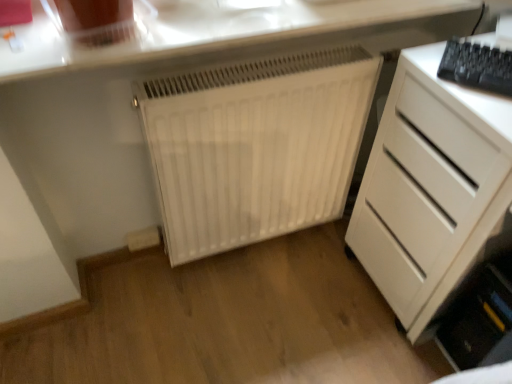
Measure the distance between point (x=445, y=75) and camera.

34.02 inches.

Locate an element on the screen. white glossy countertop at upper center is located at coordinates (206, 31).

I want to click on black plastic keyboard at upper right, so click(x=477, y=66).

Can you confirm if white matte chest of drawers at right is wider than black plastic keyboard at upper right?

Indeed, white matte chest of drawers at right has a greater width compared to black plastic keyboard at upper right.

Is white matte chest of drawers at right looking in the opposite direction of black plastic keyboard at upper right?

No, black plastic keyboard at upper right is not at the back of white matte chest of drawers at right.

The height and width of the screenshot is (384, 512). Find the location of `keyboard above the white matte chest of drawers at right (from the image's perspective)`. keyboard above the white matte chest of drawers at right (from the image's perspective) is located at coordinates (477, 66).

From the image's perspective, is white matte chest of drawers at right above black plastic keyboard at upper right?

No, from the image's perspective, white matte chest of drawers at right is not on top of black plastic keyboard at upper right.

Would you say black plastic keyboard at upper right contains white matte chest of drawers at right?

No, black plastic keyboard at upper right does not contain white matte chest of drawers at right.

Does point (452, 39) appear closer or farther from the camera than point (386, 263)?

Point (452, 39).

Which of these two, black plastic keyboard at upper right or white matte chest of drawers at right, is wider?

With larger width is white matte chest of drawers at right.

Looking at this image, considering the relative sizes of black plastic keyboard at upper right and white matte chest of drawers at right in the image provided, is black plastic keyboard at upper right smaller than white matte chest of drawers at right?

Indeed, black plastic keyboard at upper right has a smaller size compared to white matte chest of drawers at right.

How much distance is there between black plastic keyboard at upper right and white glossy countertop at upper center?

black plastic keyboard at upper right is 15.26 inches away from white glossy countertop at upper center.

Is point (509, 87) closer or farther from the camera than point (266, 35)?

Point (509, 87) is positioned closer to the camera compared to point (266, 35).

Where is `keyboard below the white glossy countertop at upper center (from a real-world perspective)`? keyboard below the white glossy countertop at upper center (from a real-world perspective) is located at coordinates (477, 66).

Who is smaller, black plastic keyboard at upper right or white glossy countertop at upper center?

black plastic keyboard at upper right is smaller.

Considering the relative sizes of black plastic keyboard at upper right and white matte radiator at center in the image provided, is black plastic keyboard at upper right shorter than white matte radiator at center?

Indeed, black plastic keyboard at upper right has a lesser height compared to white matte radiator at center.

Is black plastic keyboard at upper right looking in the opposite direction of white matte radiator at center?

No, black plastic keyboard at upper right is not facing away from white matte radiator at center.

From a real-world perspective, between black plastic keyboard at upper right and white matte radiator at center, who is vertically higher?

In real-world perspective, black plastic keyboard at upper right is above.

Is white glossy countertop at upper center not near white matte radiator at center?

No.

Is point (155, 46) closer or farther from the camera than point (252, 86)?

Point (155, 46) is closer to the camera than point (252, 86).

How different are the orientations of white glossy countertop at upper center and white matte radiator at center in degrees?

The angular difference between white glossy countertop at upper center and white matte radiator at center is 0.555 degrees.

From the image's perspective, is white glossy countertop at upper center located above or below white matte radiator at center?

From the image's perspective, white glossy countertop at upper center appears above white matte radiator at center.

Is white matte chest of drawers at right beside white matte radiator at center?

white matte chest of drawers at right is not next to white matte radiator at center, and they're not touching.

At what (x,y) coordinates should I click in order to perform the action: click on radiator lying on the left of white matte chest of drawers at right. Please return your answer as a coordinate pair (x, y). The image size is (512, 384). Looking at the image, I should click on (255, 145).

Does point (430, 139) come behind point (292, 124)?

No, it is not.

From the image's perspective, which object appears higher, white matte chest of drawers at right or white matte radiator at center?

From the image's view, white matte radiator at center is above.

The width and height of the screenshot is (512, 384). In order to click on the chest of drawers positioned vertically above the white matte radiator at center (from a real-world perspective) in this screenshot , I will do `click(432, 190)`.

Is white matte radiator at center touching white matte chest of drawers at right?

No, white matte radiator at center is not touching white matte chest of drawers at right.

Which object is closer to the camera taking this photo, white matte radiator at center or white matte chest of drawers at right?

white matte chest of drawers at right is more forward.

At what (x,y) coordinates should I click in order to perform the action: click on the chest of drawers in front of the black plastic keyboard at upper right. Please return your answer as a coordinate pair (x, y). Looking at the image, I should click on (432, 190).

What are the coordinates of `keyboard that is above the white matte chest of drawers at right (from a real-world perspective)` in the screenshot? It's located at (477, 66).

When comparing their distances from white glossy countertop at upper center, does black plastic keyboard at upper right or white matte radiator at center seem closer?

The object closer to white glossy countertop at upper center is white matte radiator at center.

Estimate the real-world distances between objects in this image. Which object is closer to white glossy countertop at upper center, white matte chest of drawers at right or black plastic keyboard at upper right?

black plastic keyboard at upper right lies closer to white glossy countertop at upper center than the other object.

Estimate the real-world distances between objects in this image. Which object is further from white matte chest of drawers at right, white glossy countertop at upper center or black plastic keyboard at upper right?

Based on the image, white glossy countertop at upper center appears to be further to white matte chest of drawers at right.

Based on their spatial positions, is white matte radiator at center or black plastic keyboard at upper right closer to white glossy countertop at upper center?

white matte radiator at center is closer to white glossy countertop at upper center.

From the image, which object appears to be farther from white matte chest of drawers at right, white glossy countertop at upper center or white matte radiator at center?

The object further to white matte chest of drawers at right is white glossy countertop at upper center.

Based on their spatial positions, is white matte radiator at center or white glossy countertop at upper center closer to white matte chest of drawers at right?

white matte radiator at center is closer to white matte chest of drawers at right.

Looking at the image, which one is located closer to white matte chest of drawers at right, black plastic keyboard at upper right or white matte radiator at center?

black plastic keyboard at upper right is positioned closer to the anchor white matte chest of drawers at right.

Considering their positions, is white matte chest of drawers at right positioned further to white matte radiator at center than white glossy countertop at upper center?

white glossy countertop at upper center is further to white matte radiator at center.

Identify the location of countertop between white matte radiator at center and white matte chest of drawers at right. The image size is (512, 384). (206, 31).

Where is `countertop between white matte radiator at center and black plastic keyboard at upper right in the horizontal direction`? The width and height of the screenshot is (512, 384). countertop between white matte radiator at center and black plastic keyboard at upper right in the horizontal direction is located at coordinates (206, 31).

Identify the location of keyboard between white matte radiator at center and white matte chest of drawers at right in the horizontal direction. This screenshot has width=512, height=384. (477, 66).

At what (x,y) coordinates should I click in order to perform the action: click on keyboard between white glossy countertop at upper center and white matte chest of drawers at right. Please return your answer as a coordinate pair (x, y). The image size is (512, 384). Looking at the image, I should click on (477, 66).